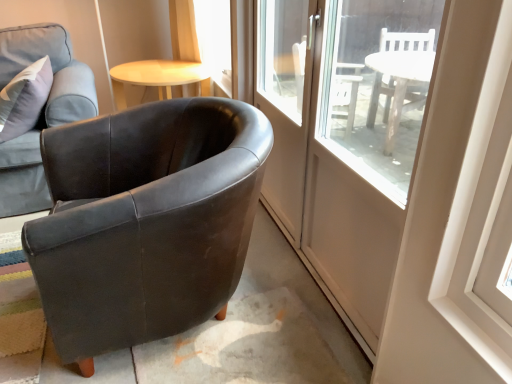
Question: Do you think light wood/woodenobject at upper center is within matte black armchair at left, which is counted as the 2th chair, starting from the left, or outside of it?

Choices:
 (A) inside
 (B) outside

Answer: (B)

Question: Is light wood/woodenobject at upper center wider or thinner than matte black armchair at left, which is counted as the 2th chair, starting from the left?

Choices:
 (A) thin
 (B) wide

Answer: (A)

Question: Estimate the real-world distances between objects in this image. Which object is farther from the clear glass door at center?

Choices:
 (A) light wood/woodenobject at upper center
 (B) matte black armchair at left, which is the second chair from right to left
 (C) matte black armchair at left, which appears as the first chair when viewed from the right

Answer: (B)

Question: Which object is positioned farthest from the matte black armchair at left, which appears as the first chair when viewed from the right?

Choices:
 (A) clear glass door at center
 (B) light wood/woodenobject at upper center
 (C) matte black armchair at left, which is the second chair from right to left

Answer: (B)